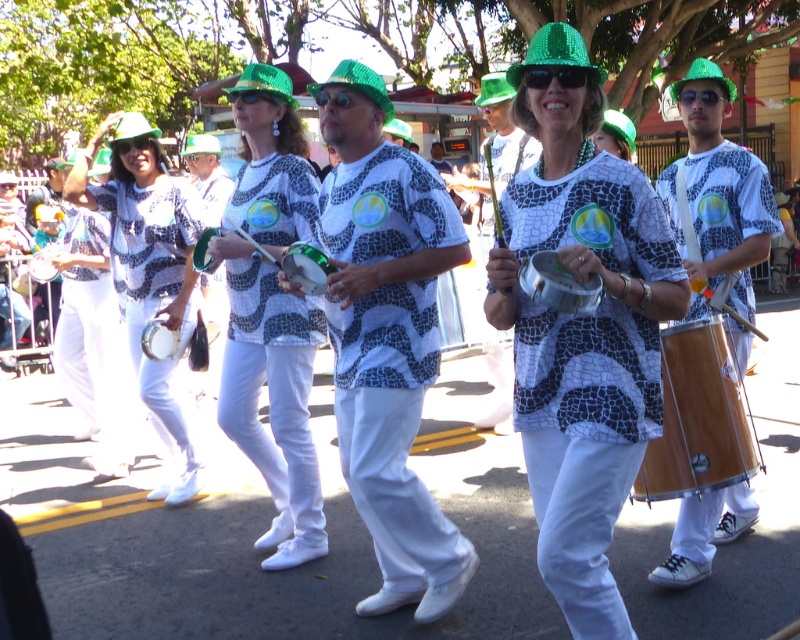
How much distance is there between shiny green hat at center and green sequined hat at center?

shiny green hat at center is 39.02 inches away from green sequined hat at center.

Who is more forward, (500,291) or (533,48)?

Point (500,291)

Between point (641, 374) and point (580, 49), which one is positioned in front?

Point (580, 49) is in front.

Locate an element on the screen. Image resolution: width=800 pixels, height=640 pixels. shiny green hat at center is located at coordinates (582, 330).

Which is behind, point (188, 269) or point (174, 346)?

The point (188, 269) is more distant.

Identify the location of matte white pants at left. (148, 266).

Between point (752, 324) and point (580, 77), which one is positioned behind?

The point (752, 324) is more distant.

Which is in front, point (748, 172) or point (576, 88)?

Point (576, 88) is in front.

The width and height of the screenshot is (800, 640). I want to click on wooden drum at center, so click(717, 205).